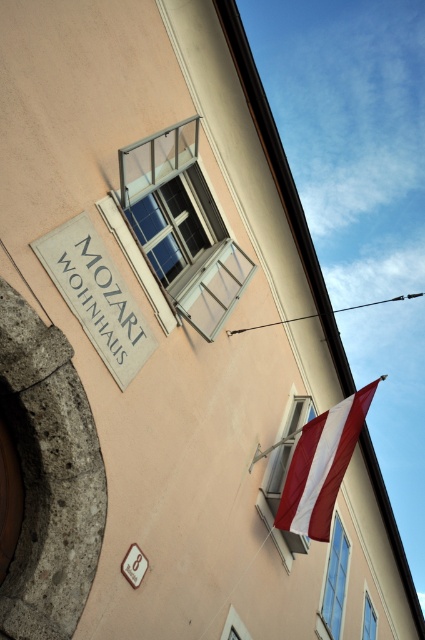
You are an architect analyzing the building facade. You notice two windows labeled clear glass window at upper center and transparent glass window at upper center. Which one is taller?

The clear glass window at upper center is much taller than the transparent glass window at upper center according to the description.

You are a window installer assessing the building. You need to replace the clear glass window at lower right and the transparent glass window at upper center. Which window requires a larger pane of glass?

The clear glass window at lower right requires a larger pane of glass because it has a larger size compared to the transparent glass window at upper center.